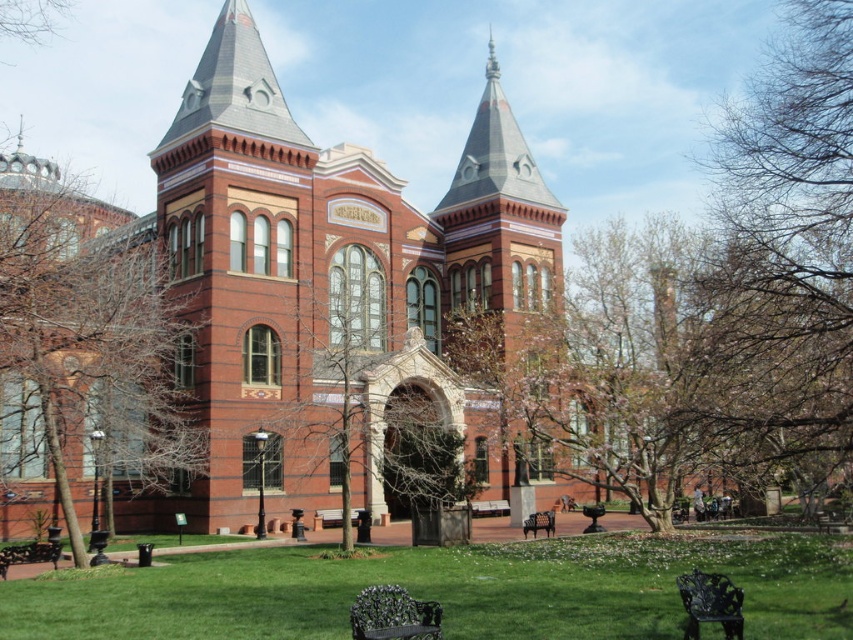
Question: Among these points, which one is nearest to the camera?

Choices:
 (A) (637, 508)
 (B) (21, 328)

Answer: (B)

Question: Which point is farther to the camera?

Choices:
 (A) red brick church at center
 (B) brown bark tree at left
 (C) black wrought iron bench at center
 (D) metallic green bench at lower center

Answer: (C)

Question: Can you confirm if red brick church at center is positioned to the left of brown bark tree at left?

Choices:
 (A) no
 (B) yes

Answer: (A)

Question: Can you confirm if bare branches at center is positioned to the right of metallic green bench at lower center?

Choices:
 (A) yes
 (B) no

Answer: (A)

Question: Is red brick church at center to the left of metallic green bench at lower center from the viewer's perspective?

Choices:
 (A) no
 (B) yes

Answer: (A)

Question: Which object appears closest to the camera in this image?

Choices:
 (A) wooden park bench at center
 (B) red brick church at center
 (C) bare wood tree at center
 (D) bare branches at center

Answer: (D)